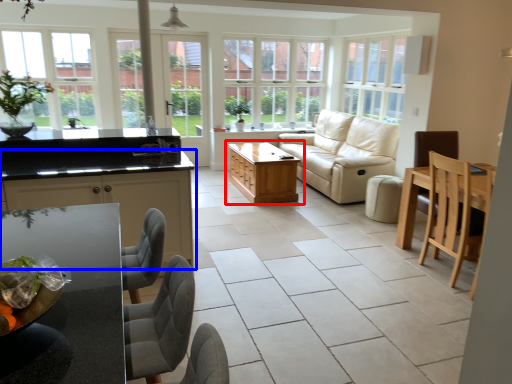
Question: Which point is further to the camera, table (highlighted by a red box) or cabinetry (highlighted by a blue box)?

Choices:
 (A) table
 (B) cabinetry

Answer: (A)